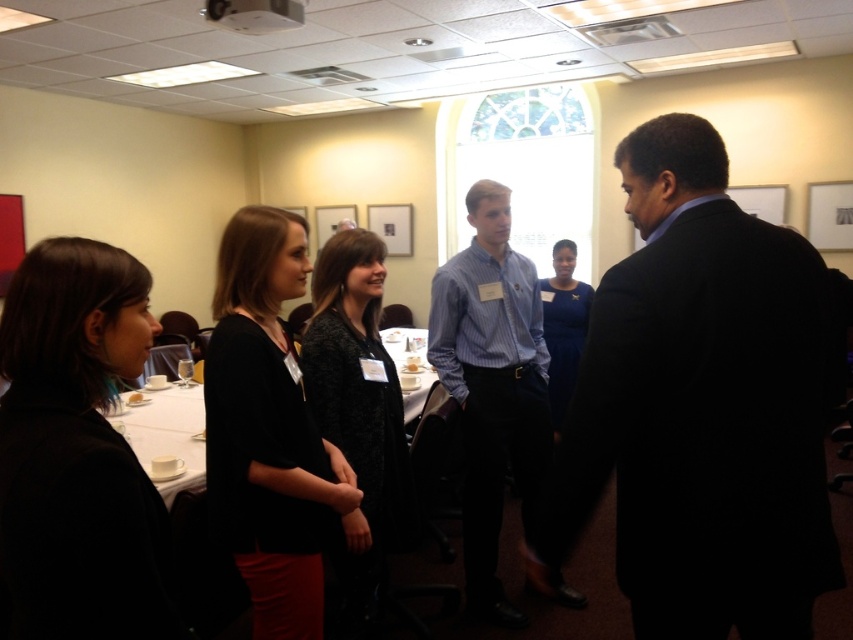
In the scene shown: You are organizing a charity event and need to display two dresses in a showcase. The showcase has a limited space. Given the black matte dress at center and the blue satin dress at center, which dress requires more space due to its size?

The black matte dress at center requires more space because it has a larger size compared to the blue satin dress at center.

You are standing at the entrance of the conference room. You need to locate the black matte dress at center. According to the coordinates provided, in which direction should you move from your current position to reach it?

The black matte dress at center is located at coordinates point (x=268, y=429). Since you are at the entrance, you should move towards the center of the room to reach it.